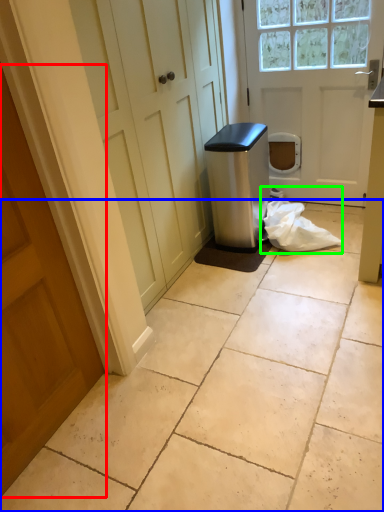
Question: Considering the real-world distances, which object is farthest from door (highlighted by a red box)? concrete (highlighted by a blue box) or material (highlighted by a green box)?

Choices:
 (A) concrete
 (B) material

Answer: (B)